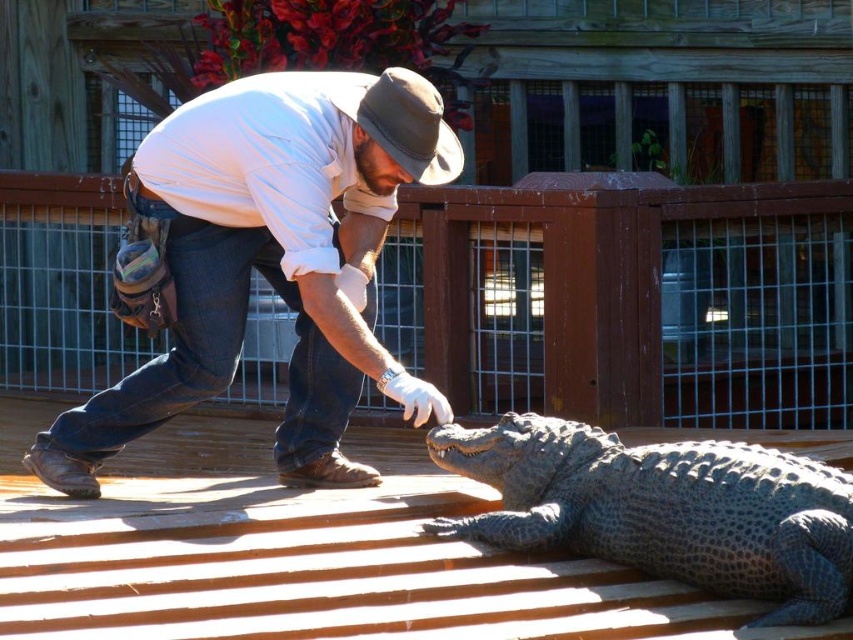
Is matte white shirt at center bigger than gray scaly crocodile at lower right?

No.

Does matte white shirt at center have a greater width compared to gray scaly crocodile at lower right?

No, matte white shirt at center is not wider than gray scaly crocodile at lower right.

Between point (366, 323) and point (809, 586), which one is positioned behind?

Point (366, 323)

Where is `matte white shirt at center`? matte white shirt at center is located at coordinates (267, 260).

This screenshot has height=640, width=853. What do you see at coordinates (300, 554) in the screenshot? I see `brown wooden deck at center` at bounding box center [300, 554].

Who is shorter, brown wooden deck at center or gray scaly crocodile at lower right?

With less height is gray scaly crocodile at lower right.

Which is in front, point (361, 493) or point (602, 554)?

Point (602, 554) is more forward.

The image size is (853, 640). In order to click on brown wooden deck at center in this screenshot , I will do `click(300, 554)`.

How much distance is there between brown wooden deck at center and matte white shirt at center?

brown wooden deck at center and matte white shirt at center are 6.55 meters apart from each other.

Looking at this image, how distant is brown wooden deck at center from matte white shirt at center?

brown wooden deck at center is 6.55 meters away from matte white shirt at center.

Is point (287, 572) farther from camera compared to point (306, 381)?

No, (287, 572) is in front of (306, 381).

Where is `brown wooden deck at center`? The image size is (853, 640). brown wooden deck at center is located at coordinates (300, 554).